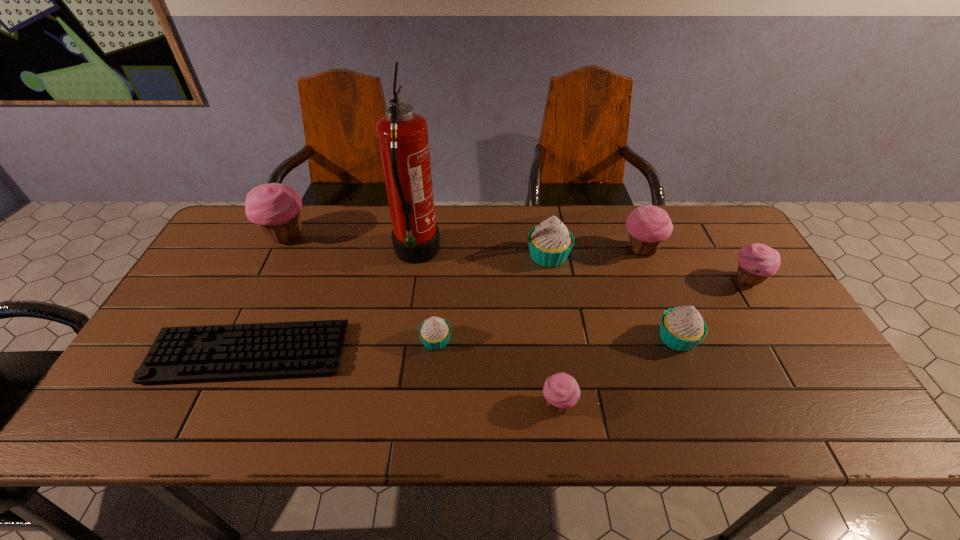
I want to click on vacant space situated on the right of the rightmost white cupcake, so click(761, 338).

At what (x,y) coordinates should I click in order to perform the action: click on vacant region located on the back of the leftmost white cupcake. Please return your answer as a coordinate pair (x, y). Looking at the image, I should click on (442, 269).

You are a GUI agent. You are given a task and a screenshot of the screen. Output one action in this format:
    pyautogui.click(x=<x>, y=<y>)
    Task: Click on the vacant space located 0.320m on the back of the nearest object
    
    Given the screenshot: What is the action you would take?
    pyautogui.click(x=542, y=289)

Image resolution: width=960 pixels, height=540 pixels. I want to click on blank space located 0.380m on the right of the computer keyboard, so click(x=499, y=353).

I want to click on fire extinguisher that is at the far edge, so click(x=402, y=135).

At what (x,y) coordinates should I click in order to perform the action: click on object at the near edge. Please return your answer as a coordinate pair (x, y). This screenshot has width=960, height=540. Looking at the image, I should click on (561, 391).

Find the location of a particular element. cupcake that is at the left edge is located at coordinates (275, 207).

Where is `computer keyboard positioned at the left edge`? The height and width of the screenshot is (540, 960). computer keyboard positioned at the left edge is located at coordinates (306, 348).

At what (x,y) coordinates should I click in order to perform the action: click on object positioned at the right edge. Please return your answer as a coordinate pair (x, y). The width and height of the screenshot is (960, 540). Looking at the image, I should click on (757, 262).

Locate an element on the screen. object situated at the far left corner is located at coordinates (275, 207).